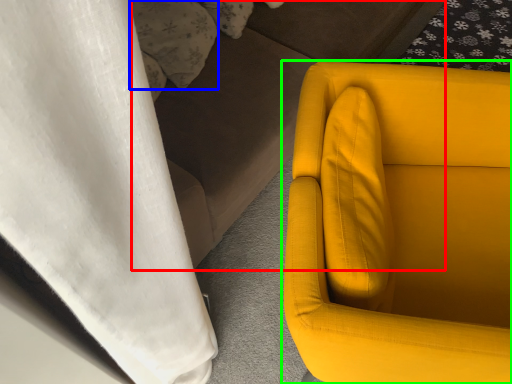
Question: Considering the real-world distances, which object is farthest from couch (highlighted by a red box)? pillow (highlighted by a blue box) or chair (highlighted by a green box)?

Choices:
 (A) pillow
 (B) chair

Answer: (B)